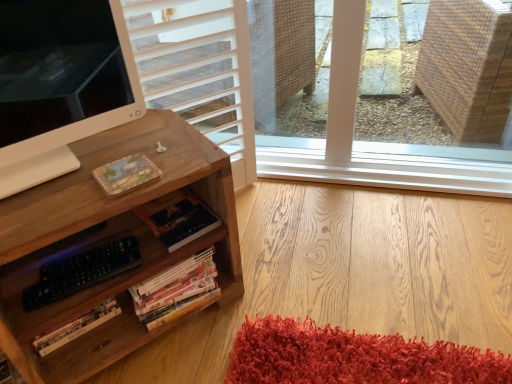
Question: From a real-world perspective, is hardcover book at center, the 1th book viewed from the top, positioned under hardcover books at lower center, which is counted as the 2th book, starting from the top, based on gravity?

Choices:
 (A) no
 (B) yes

Answer: (A)

Question: Is hardcover book at center, the 1th book viewed from the top, smaller than hardcover books at lower center, which is counted as the 2th book, starting from the top?

Choices:
 (A) no
 (B) yes

Answer: (B)

Question: Does hardcover book at center, the 2th book in the bottom-to-top sequence, have a larger size compared to hardcover books at lower center, marked as the 1th book in a bottom-to-top arrangement?

Choices:
 (A) no
 (B) yes

Answer: (A)

Question: Can you confirm if hardcover book at center, the 2th book in the bottom-to-top sequence, is shorter than hardcover books at lower center, which is counted as the 2th book, starting from the top?

Choices:
 (A) no
 (B) yes

Answer: (B)

Question: Is hardcover books at lower center, marked as the 1th book in a bottom-to-top arrangement, at the back of hardcover book at center, the 1th book viewed from the top?

Choices:
 (A) yes
 (B) no

Answer: (B)

Question: Is wooden desk at left to the left or to the right of hardcover books at lower center, which is counted as the 2th book, starting from the top, in the image?

Choices:
 (A) left
 (B) right

Answer: (A)

Question: From a real-world perspective, relative to hardcover books at lower center, marked as the 1th book in a bottom-to-top arrangement, is wooden desk at left vertically above or below?

Choices:
 (A) above
 (B) below

Answer: (A)

Question: Is wooden desk at left wider or thinner than hardcover books at lower center, which is counted as the 2th book, starting from the top?

Choices:
 (A) thin
 (B) wide

Answer: (B)

Question: From the image's perspective, is wooden desk at left above or below hardcover books at lower center, marked as the 1th book in a bottom-to-top arrangement?

Choices:
 (A) above
 (B) below

Answer: (A)

Question: Choose the correct answer: Is hardcover book at center, the 2th book in the bottom-to-top sequence, inside hardcover books at lower center, which is counted as the 2th book, starting from the top, or outside it?

Choices:
 (A) outside
 (B) inside

Answer: (A)

Question: In terms of width, does hardcover book at center, the 1th book viewed from the top, look wider or thinner when compared to hardcover books at lower center, marked as the 1th book in a bottom-to-top arrangement?

Choices:
 (A) wide
 (B) thin

Answer: (A)

Question: Is hardcover book at center, the 2th book in the bottom-to-top sequence, bigger or smaller than hardcover books at lower center, marked as the 1th book in a bottom-to-top arrangement?

Choices:
 (A) small
 (B) big

Answer: (A)

Question: In the image, is hardcover book at center, the 1th book viewed from the top, on the left side or the right side of hardcover books at lower center, marked as the 1th book in a bottom-to-top arrangement?

Choices:
 (A) left
 (B) right

Answer: (B)

Question: Is hardcover books at lower center, marked as the 1th book in a bottom-to-top arrangement, taller or shorter than wooden desk at left?

Choices:
 (A) tall
 (B) short

Answer: (B)

Question: Based on their positions, is hardcover books at lower center, marked as the 1th book in a bottom-to-top arrangement, located to the left or right of wooden desk at left?

Choices:
 (A) right
 (B) left

Answer: (A)